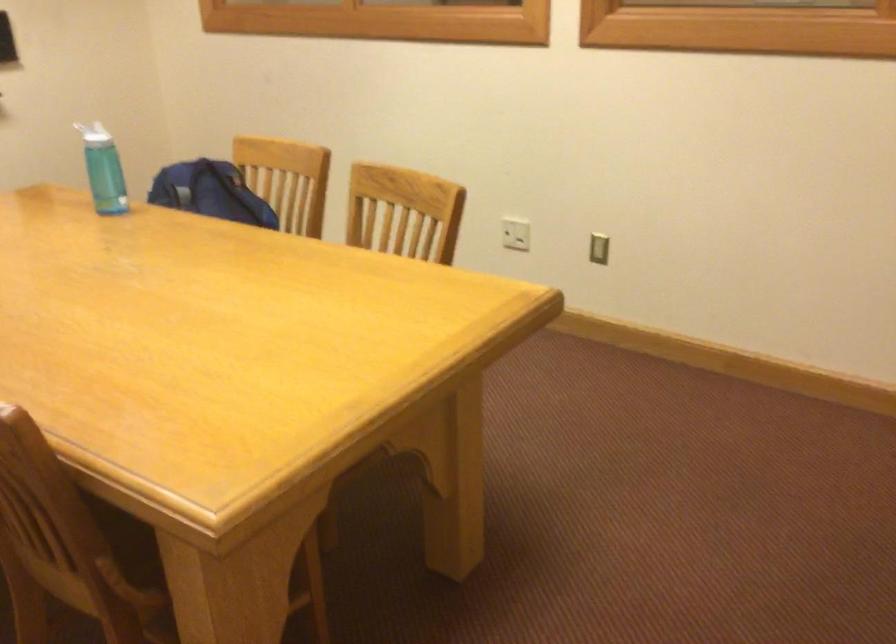
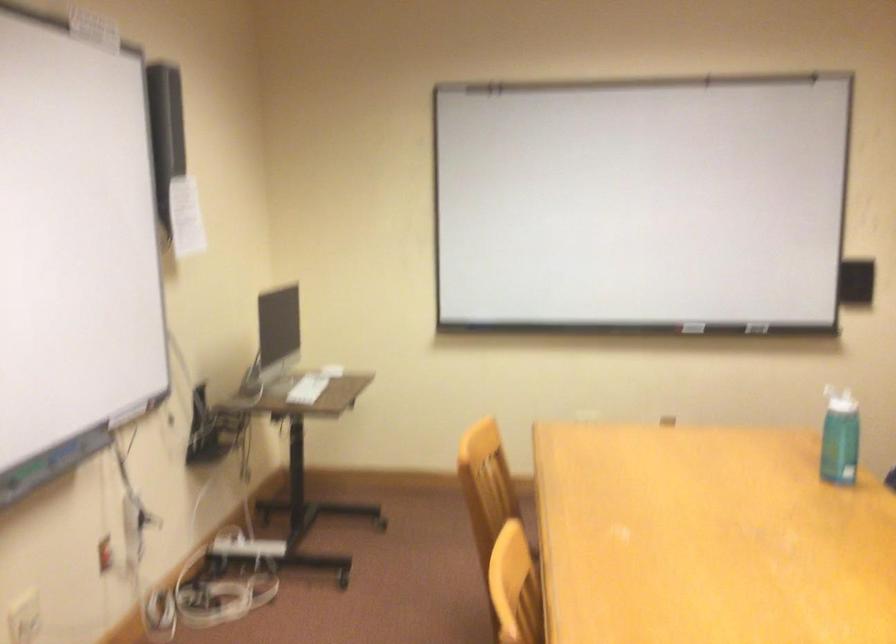
Question: The camera is either moving clockwise (left) or counter-clockwise (right) around the object. The first image is from the beginning of the video and the second image is from the end. Is the camera moving left or right when shooting the video?

Choices:
 (A) Left
 (B) Right

Answer: (B)